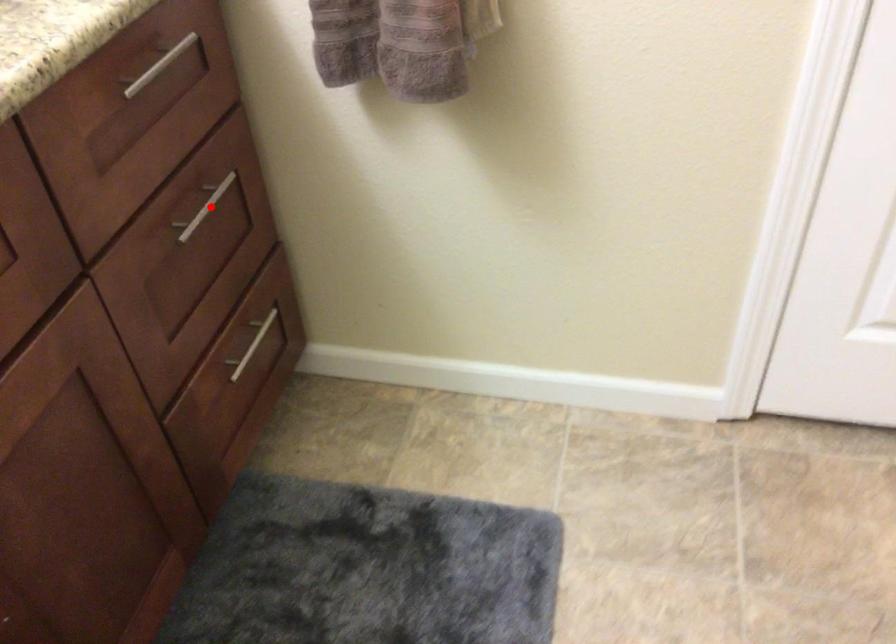
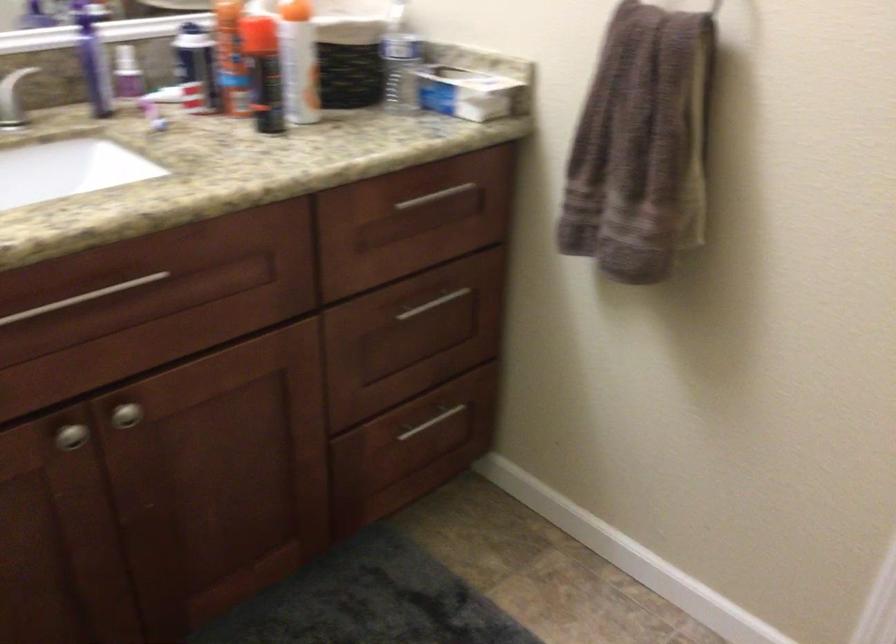
Where in the second image is the point corresponding to the highlighted location from the first image?

(434, 304)